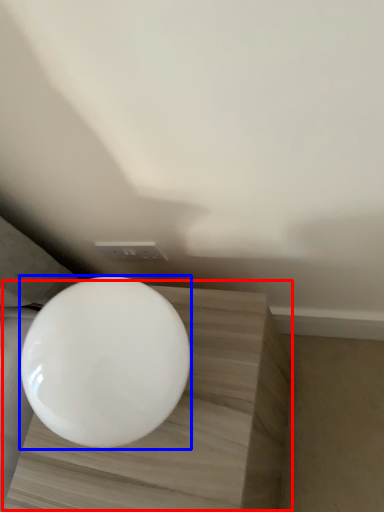
Question: Among these objects, which one is farthest to the camera, table (highlighted by a red box) or toilet (highlighted by a blue box)?

Choices:
 (A) table
 (B) toilet

Answer: (A)